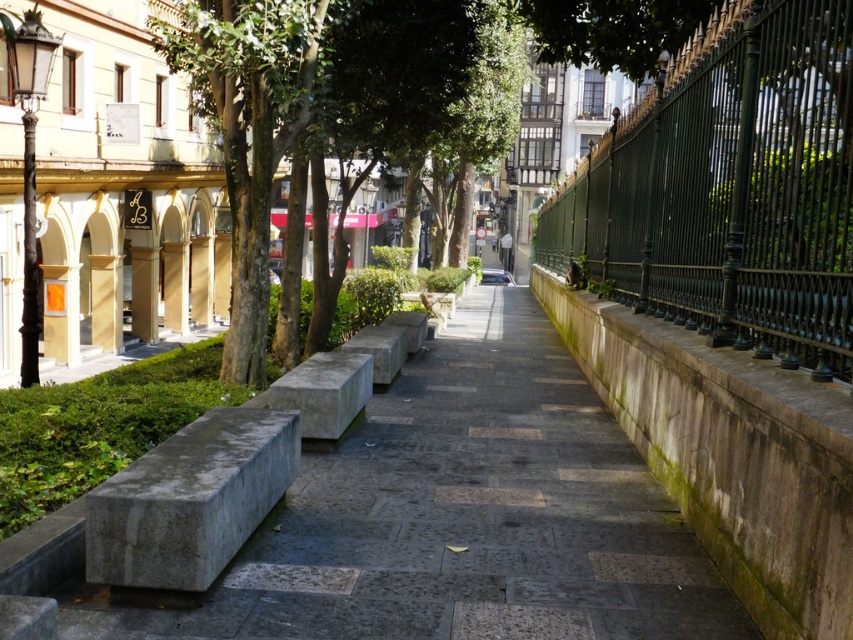
Can you confirm if gray stone pavement at center is positioned to the right of gray concrete bench at center?

Indeed, gray stone pavement at center is positioned on the right side of gray concrete bench at center.

Looking at this image, which is below, gray stone pavement at center or gray concrete bench at center?

gray stone pavement at center

The image size is (853, 640). Find the location of `gray stone pavement at center`. gray stone pavement at center is located at coordinates (456, 518).

Find the location of a particular element. The height and width of the screenshot is (640, 853). gray stone pavement at center is located at coordinates (456, 518).

Between point (465, 461) and point (194, 76), which one is positioned in front?

Positioned in front is point (465, 461).

I want to click on gray stone pavement at center, so click(456, 518).

Who is positioned more to the left, green wrought iron fence at right or gray concrete bench at center?

From the viewer's perspective, gray concrete bench at center appears more on the left side.

Who is more forward, (x=724, y=186) or (x=331, y=364)?

Point (x=724, y=186)

Which is behind, point (798, 346) or point (366, 355)?

The point (366, 355) is behind.

Where is `green wrought iron fence at right`? The height and width of the screenshot is (640, 853). green wrought iron fence at right is located at coordinates (730, 188).